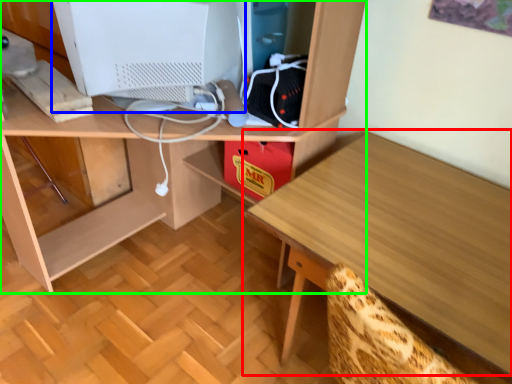
Question: Which object is positioned closest to table (highlighted by a red box)? Select from computer monitor (highlighted by a blue box) and desk (highlighted by a green box).

Choices:
 (A) computer monitor
 (B) desk

Answer: (B)